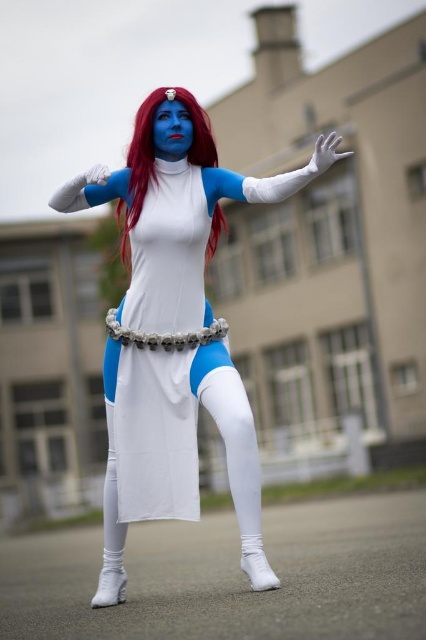
You are a photographer setting up for a photoshoot. You need to position a lighting rig that can cover both the matte white costume at center and the white matte leggings at lower center. Given that the lighting rig has a maximum coverage radius of 3 meters, will it be sufficient to illuminate both objects adequately?

The distance between the matte white costume at center and the white matte leggings at lower center is 2.57 meters, which is within the 3 meter coverage radius of the lighting rig. Therefore, the lighting rig will be sufficient to illuminate both objects adequately.

You are a costume designer inspecting the Mystique costume. You notice the white matte glove at upper center and the gray metallic belt at center. Which object is placed higher in the costume?

The white matte glove at upper center is positioned over the gray metallic belt at center, meaning it is placed higher on the costume.